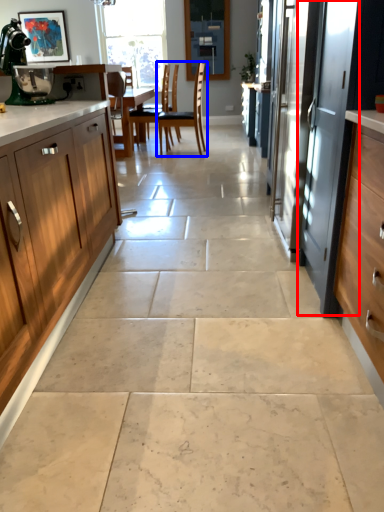
Question: Which object is further to the camera taking this photo, screen door (highlighted by a red box) or chair (highlighted by a blue box)?

Choices:
 (A) screen door
 (B) chair

Answer: (B)